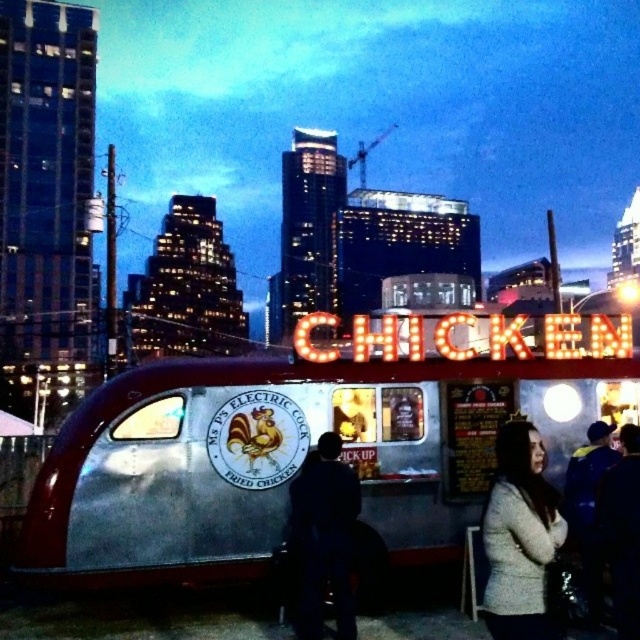
Question: Which of the following is the closest to the observer?

Choices:
 (A) (330, 564)
 (B) (520, 538)

Answer: (B)

Question: Does light gray sweater at lower right appear on the left side of dark fabric jacket at center?

Choices:
 (A) yes
 (B) no

Answer: (B)

Question: Considering the real-world distances, which object is closest to the dark fabric jacket at center?

Choices:
 (A) neontexturedsign at center
 (B) light gray sweater at lower right

Answer: (A)

Question: Can you confirm if neontexturedsign at center is positioned to the right of dark fabric jacket at center?

Choices:
 (A) yes
 (B) no

Answer: (A)

Question: Among these points, which one is nearest to the camera?

Choices:
 (A) (310, 595)
 (B) (550, 634)
 (C) (300, 349)
 (D) (196, 369)

Answer: (B)

Question: Observing the image, what is the correct spatial positioning of silver metallic food truck at center in reference to light gray sweater at lower right?

Choices:
 (A) right
 (B) left

Answer: (B)